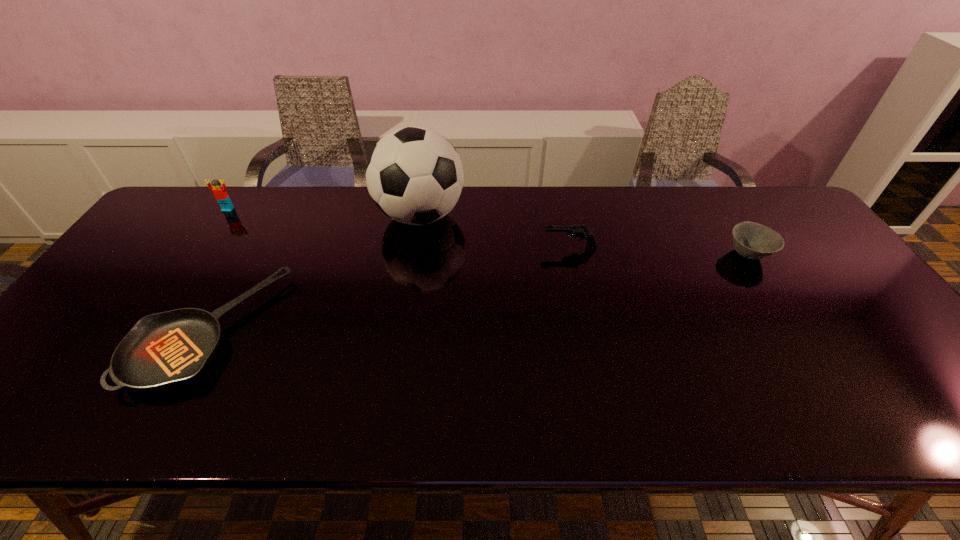
This screenshot has width=960, height=540. In order to click on vacant space at the near edge in this screenshot , I will do `click(801, 397)`.

This screenshot has width=960, height=540. I want to click on vacant space at the left edge of the desktop, so click(118, 269).

The width and height of the screenshot is (960, 540). I want to click on free space at the right edge of the desktop, so click(x=885, y=357).

The width and height of the screenshot is (960, 540). Find the location of `free region at the near right corner`. free region at the near right corner is located at coordinates [924, 397].

Where is `vacant point located between the nearest object and the fourth object from left to right`? The image size is (960, 540). vacant point located between the nearest object and the fourth object from left to right is located at coordinates (389, 289).

You are a GUI agent. You are given a task and a screenshot of the screen. Output one action in this format:
    pyautogui.click(x=<x>, y=<y>)
    Task: Click on the vacant space that's between the tallest object and the second tallest object
    The width and height of the screenshot is (960, 540).
    Given the screenshot: What is the action you would take?
    pyautogui.click(x=324, y=213)

Where is `vacant space that is in between the third object from left to right and the shortest object`? This screenshot has height=540, width=960. vacant space that is in between the third object from left to right and the shortest object is located at coordinates coord(314,273).

This screenshot has width=960, height=540. What are the coordinates of `vacant region between the gun and the frying pan` in the screenshot? It's located at coord(389,289).

Identify the location of free space between the third shortest object and the Lego. (398, 228).

Find the location of a particular element. The image size is (960, 540). free space between the fourth shortest object and the rightmost object is located at coordinates (488, 232).